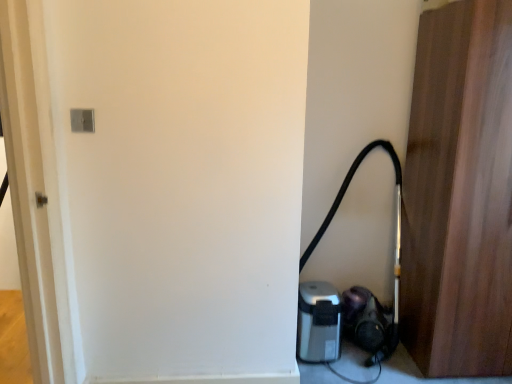
Question: Based on their positions, is silver metallic coffee maker at lower right located to the left or right of wooden door at right?

Choices:
 (A) right
 (B) left

Answer: (B)

Question: In the image, is silver metallic coffee maker at lower right positioned in front of or behind wooden door at right?

Choices:
 (A) behind
 (B) front

Answer: (A)

Question: Which object is positioned closest to the black rubber garden hose at lower right?

Choices:
 (A) wooden door at right
 (B) silver metallic coffee maker at lower right

Answer: (B)

Question: Based on their relative distances, which object is farther from the silver metallic coffee maker at lower right?

Choices:
 (A) black rubber garden hose at lower right
 (B) wooden door at right

Answer: (B)